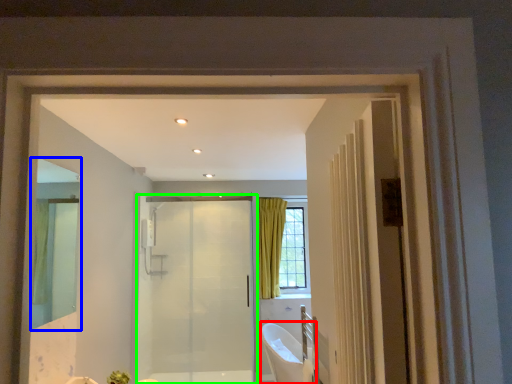
Question: Which is nearer to the bath (highlighted by a red box)? mirror (highlighted by a blue box) or door (highlighted by a green box).

Choices:
 (A) mirror
 (B) door

Answer: (B)